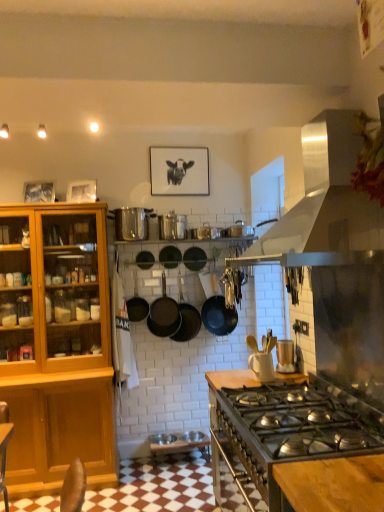
What do you see at coordinates (170, 257) in the screenshot?
I see `black matte frying pan at center, the third frying pan viewed from the right` at bounding box center [170, 257].

Measure the distance between point (209, 237) and camera.

The distance of point (209, 237) from camera is 11.77 feet.

What is the approximate width of stainless steel range hood at upper right?

The width of stainless steel range hood at upper right is 21.25 inches.

At what (x,y) coordinates should I click in order to perform the action: click on black matte frying pan at center, which ranks as the 3th frying pan in left-to-right order. Please return your answer as a coordinate pair (x, y). The width and height of the screenshot is (384, 512). Looking at the image, I should click on (216, 308).

Image resolution: width=384 pixels, height=512 pixels. I want to click on black matte wok at center, the second wok positioned from the right, so click(164, 314).

The image size is (384, 512). Find the location of `black matte frying pan at center, which ranks as the 1th frying pan in left-to-right order`. black matte frying pan at center, which ranks as the 1th frying pan in left-to-right order is located at coordinates (170, 257).

Is point (195, 318) behind point (169, 250)?

Yes.

From a real-world perspective, is black matte wok at center, the second wok viewed from the left, below black matte frying pan at center, which ranks as the 1th frying pan in left-to-right order?

Indeed, from a real-world perspective, black matte wok at center, the second wok viewed from the left, is positioned beneath black matte frying pan at center, which ranks as the 1th frying pan in left-to-right order.

Identify the location of wok that is the 2nd object directly below the black matte frying pan at center, which ranks as the 1th frying pan in left-to-right order (from a real-world perspective). (186, 318).

What's the angular difference between black matte wok at center, which is the first wok from right to left, and black matte frying pan at center, which ranks as the 1th frying pan in left-to-right order,'s facing directions?

The facing directions of black matte wok at center, which is the first wok from right to left, and black matte frying pan at center, which ranks as the 1th frying pan in left-to-right order, are 1.56 degrees apart.

In the scene shown: Is metallic silver pot at upper center, the 1th appliance when ordered from top to bottom, at the back of black matte picture frame at upper center?

No, metallic silver pot at upper center, the 1th appliance when ordered from top to bottom, is not at the back of black matte picture frame at upper center.

Is black matte picture frame at upper center not inside metallic silver pot at upper center, acting as the fourth appliance starting from the right?

That's correct, black matte picture frame at upper center is outside of metallic silver pot at upper center, acting as the fourth appliance starting from the right.

From a real-world perspective, is black matte picture frame at upper center physically above metallic silver pot at upper center, the first appliance when ordered from left to right?

Yes.

Is there a large distance between black matte picture frame at upper center and metallic silver pot at upper center, the second appliance positioned from the front?

No, there isn't a large distance between black matte picture frame at upper center and metallic silver pot at upper center, the second appliance positioned from the front.

Looking at this image, are stainless steel range hood at upper right and wooden cutting board at center far apart?

No.

In the scene shown: From a real-world perspective, is stainless steel range hood at upper right located higher than wooden cutting board at center?

Yes, from a real-world perspective, stainless steel range hood at upper right is on top of wooden cutting board at center.

From the image's perspective, does stainless steel range hood at upper right appear lower than wooden cutting board at center?

No, from the image's perspective, stainless steel range hood at upper right is not below wooden cutting board at center.

Which is more to the right, stainless steel range hood at upper right or wooden cutting board at center?

Positioned to the right is stainless steel range hood at upper right.

In terms of height, does stainless steel range hood at upper right look taller or shorter compared to matte black frying pan at center, positioned as the 2th frying pan in left-to-right order?

Clearly, stainless steel range hood at upper right is taller compared to matte black frying pan at center, positioned as the 2th frying pan in left-to-right order.

Can you confirm if stainless steel range hood at upper right is positioned to the right of matte black frying pan at center, placed as the second frying pan when sorted from right to left?

Yes, stainless steel range hood at upper right is to the right of matte black frying pan at center, placed as the second frying pan when sorted from right to left.

The width and height of the screenshot is (384, 512). In order to click on kitchen appliance in front of the matte black frying pan at center, positioned as the 2th frying pan in left-to-right order in this screenshot , I will do `click(326, 193)`.

Is matte black frying pan at center, positioned as the 2th frying pan in left-to-right order, placed right next to metallic silver pots at center, placed as the third appliance when sorted from top to bottom?

No.

From the matte black frying pan at center, positioned as the 2th frying pan in left-to-right order, count 1st appliances forward and point to it. Please provide its 2D coordinates.

[(206, 232)]

Considering the positions of objects matte black frying pan at center, placed as the second frying pan when sorted from right to left, and metallic silver pots at center, which ranks as the fourth appliance in front-to-back order, in the image provided, who is more to the left, matte black frying pan at center, placed as the second frying pan when sorted from right to left, or metallic silver pots at center, which ranks as the fourth appliance in front-to-back order,?

Positioned to the left is matte black frying pan at center, placed as the second frying pan when sorted from right to left.

From a real-world perspective, between matte black frying pan at center, positioned as the 2th frying pan in left-to-right order, and metallic silver pots at center, which is the 1th appliance from back to front, who is vertically lower?

From a 3D spatial view, matte black frying pan at center, positioned as the 2th frying pan in left-to-right order, is below.

Is black matte picture frame at upper center facing away from black matte wok at center, the first wok in the left-to-right sequence?

No, black matte wok at center, the first wok in the left-to-right sequence, is not at the back of black matte picture frame at upper center.

From the image's perspective, relative to black matte wok at center, the first wok in the left-to-right sequence, is black matte picture frame at upper center above or below?

black matte picture frame at upper center is situated higher than black matte wok at center, the first wok in the left-to-right sequence, in the image.

Considering the positions of objects black matte picture frame at upper center and black matte wok at center, the first wok in the left-to-right sequence, in the image provided, who is more to the right, black matte picture frame at upper center or black matte wok at center, the first wok in the left-to-right sequence,?

black matte picture frame at upper center.

Locate an element on the screen. This screenshot has height=512, width=384. picture frame that is above the black matte wok at center, the first wok in the left-to-right sequence (from the image's perspective) is located at coordinates (179, 170).

Is black matte frying pan at center, which ranks as the 1th frying pan in left-to-right order, directly adjacent to metallic silver pot at upper center, the 1th appliance when ordered from top to bottom?

No, black matte frying pan at center, which ranks as the 1th frying pan in left-to-right order, is not beside metallic silver pot at upper center, the 1th appliance when ordered from top to bottom.

Considering the relative sizes of black matte frying pan at center, which ranks as the 1th frying pan in left-to-right order, and metallic silver pot at upper center, the first appliance when ordered from left to right, in the image provided, is black matte frying pan at center, which ranks as the 1th frying pan in left-to-right order, shorter than metallic silver pot at upper center, the first appliance when ordered from left to right,?

Yes, black matte frying pan at center, which ranks as the 1th frying pan in left-to-right order, is shorter than metallic silver pot at upper center, the first appliance when ordered from left to right.

Is metallic silver pot at upper center, acting as the fourth appliance starting from the right, surrounded by black matte frying pan at center, which ranks as the 1th frying pan in left-to-right order?

Actually, metallic silver pot at upper center, acting as the fourth appliance starting from the right, is outside black matte frying pan at center, which ranks as the 1th frying pan in left-to-right order.

This screenshot has height=512, width=384. I want to click on frying pan on the left of the black matte wok at center, the second wok viewed from the left, so pos(170,257).

Where is `picture frame behind the metallic silver pot at upper center, positioned as the third appliance in back-to-front order`? This screenshot has height=512, width=384. picture frame behind the metallic silver pot at upper center, positioned as the third appliance in back-to-front order is located at coordinates (179, 170).

Considering their positions, is black matte frying pan at center, the third frying pan viewed from the right, positioned further to matte black frying pan at center, positioned as the 2th frying pan in left-to-right order, than metallic silver pot at center, which is the second appliance in left-to-right order?

The object further to matte black frying pan at center, positioned as the 2th frying pan in left-to-right order, is metallic silver pot at center, which is the second appliance in left-to-right order.

From the image, which object appears to be farther from stainless steel range hood at upper right, silver metallic bar stool at lower center or metallic silver toaster at upper right, arranged as the first appliance when ordered from the bottom?

Based on the image, silver metallic bar stool at lower center appears to be further to stainless steel range hood at upper right.

Looking at the image, which one is located closer to matte black frying pan at center, positioned as the 2th frying pan in left-to-right order, stainless steel range hood at upper right or black matte frying pan at center, which ranks as the 1th frying pan in left-to-right order?

Based on the image, black matte frying pan at center, which ranks as the 1th frying pan in left-to-right order, appears to be nearer to matte black frying pan at center, positioned as the 2th frying pan in left-to-right order.

From the image, which object appears to be farther from metallic silver pot at center, which is the second appliance in left-to-right order, black matte frying pan at center, which ranks as the 1th frying pan in left-to-right order, or silver metallic bar stool at lower center?

silver metallic bar stool at lower center is positioned further to the anchor metallic silver pot at center, which is the second appliance in left-to-right order.

When comparing their distances from black matte frying pan at center, which ranks as the 3th frying pan in left-to-right order, does stainless steel range hood at upper right or metallic silver pot at upper center, acting as the 4th appliance starting from the bottom, seem closer?

The object closer to black matte frying pan at center, which ranks as the 3th frying pan in left-to-right order, is metallic silver pot at upper center, acting as the 4th appliance starting from the bottom.

When comparing their distances from silver metallic bar stool at lower center, does wooden cutting board at center or stainless steel range hood at upper right seem further?

stainless steel range hood at upper right lies further to silver metallic bar stool at lower center than the other object.

Which object lies further to the anchor point silver metallic bar stool at lower center, black matte wok at center, the second wok positioned from the right, or metallic silver pot at center, which is the second appliance from top to bottom?

Among the two, metallic silver pot at center, which is the second appliance from top to bottom, is located further to silver metallic bar stool at lower center.

Which object lies further to the anchor point matte black frying pan at center, placed as the second frying pan when sorted from right to left, metallic silver pot at center, which is the 3th appliance in right-to-left order, or black matte frying pan at center, the third frying pan viewed from the right?

Among the two, metallic silver pot at center, which is the 3th appliance in right-to-left order, is located further to matte black frying pan at center, placed as the second frying pan when sorted from right to left.

Locate an element on the screen. appliance between black matte picture frame at upper center and metallic silver pot at center, the third appliance from the front, vertically is located at coordinates (131, 223).

Where is `bar stool positioned between wooden cutting board at center and metallic silver pot at center, the third appliance from the bottom, from near to far`? This screenshot has height=512, width=384. bar stool positioned between wooden cutting board at center and metallic silver pot at center, the third appliance from the bottom, from near to far is located at coordinates (179, 443).

Where is `appliance located between wooden cutting board at center and metallic silver pot at upper center, the 1th appliance when ordered from top to bottom, in the depth direction`? The image size is (384, 512). appliance located between wooden cutting board at center and metallic silver pot at upper center, the 1th appliance when ordered from top to bottom, in the depth direction is located at coordinates (285, 356).

I want to click on bar stool between wooden cutting board at center and black matte frying pan at center, the first frying pan positioned from the right, from front to back, so click(x=179, y=443).